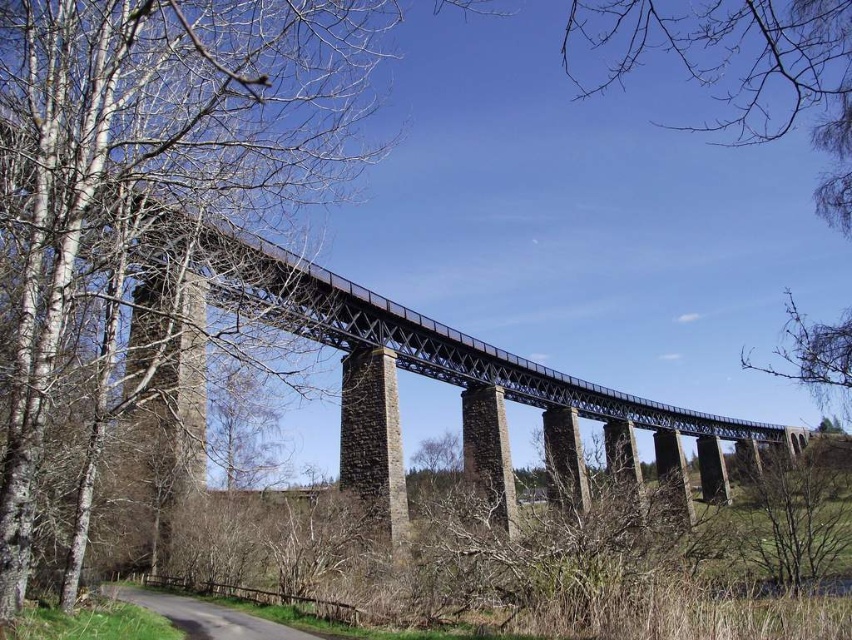
Question: Which object appears farthest from the camera in this image?

Choices:
 (A) bare wood tree at left
 (B) brown stone bridge at center
 (C) bare branches at upper center

Answer: (C)

Question: Is bare wood tree at left above bare branches at upper center?

Choices:
 (A) yes
 (B) no

Answer: (B)

Question: Considering the real-world distances, which object is farthest from the bare branches at upper center?

Choices:
 (A) bare wood tree at left
 (B) brown stone bridge at center

Answer: (A)

Question: Which object is closer to the camera taking this photo?

Choices:
 (A) bare wood tree at left
 (B) brown stone bridge at center

Answer: (B)

Question: Can you confirm if bare wood tree at left is positioned to the left of brown stone bridge at center?

Choices:
 (A) yes
 (B) no

Answer: (A)

Question: Is bare wood tree at left positioned behind bare branches at upper center?

Choices:
 (A) yes
 (B) no

Answer: (B)